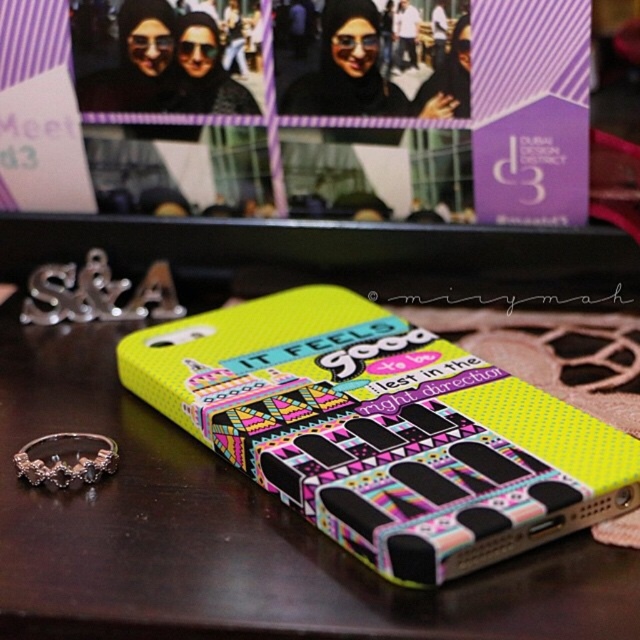
Question: Does neon yellow textured phone case at center lie in front of silver metallic letters at center?

Choices:
 (A) yes
 (B) no

Answer: (A)

Question: Among these objects, which one is farthest from the camera?

Choices:
 (A) neon yellow textured phone case at center
 (B) silver metallic letters at center

Answer: (B)

Question: Is neon yellow textured phone case at center in front of silver metallic letters at center?

Choices:
 (A) yes
 (B) no

Answer: (A)

Question: Observing the image, what is the correct spatial positioning of neon yellow textured phone case at center in reference to silver metallic letters at center?

Choices:
 (A) right
 (B) left

Answer: (A)

Question: Which object is farther from the camera taking this photo?

Choices:
 (A) silver metallic letters at center
 (B) neon yellow textured phone case at center

Answer: (A)

Question: Which object is farther from the camera taking this photo?

Choices:
 (A) neon yellow textured phone case at center
 (B) silver metallic letters at center

Answer: (B)